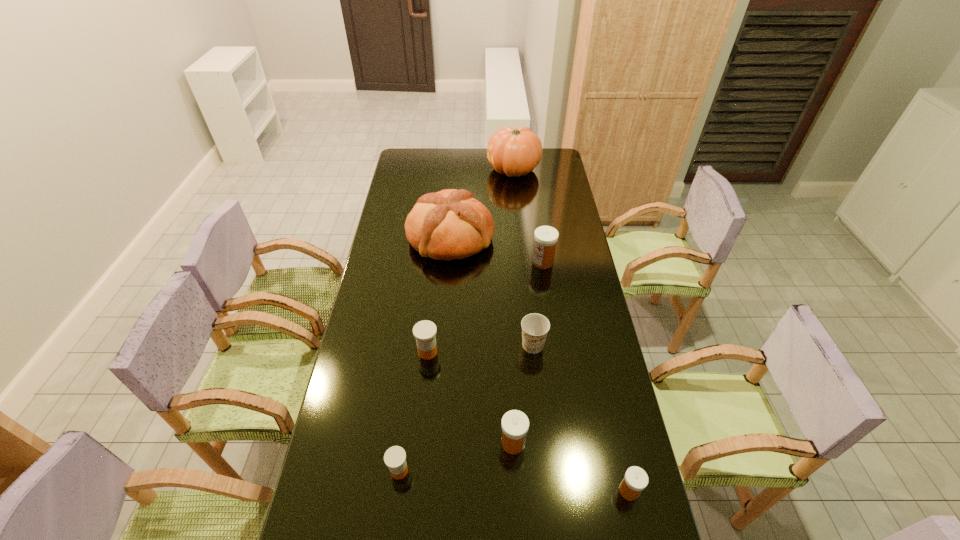
Find the location of a particular element. the smallest white medicine is located at coordinates (635, 480).

This screenshot has width=960, height=540. Identify the location of the nearest white medicine. (635, 480).

Locate an element on the screen. This screenshot has height=540, width=960. vacant space located on the carved face of the pumpkin is located at coordinates (431, 170).

Identify the location of vacant space positioned 0.400m on the carved face of the pumpkin. (410, 170).

Where is `vacant space located on the carved face of the pumpkin`? This screenshot has width=960, height=540. vacant space located on the carved face of the pumpkin is located at coordinates coord(468,170).

Where is `free spot located on the front of the bread`? The image size is (960, 540). free spot located on the front of the bread is located at coordinates (443, 338).

Locate an element on the screen. The height and width of the screenshot is (540, 960). vacant space located on the front of the farthest white medicine is located at coordinates (553, 333).

This screenshot has width=960, height=540. Find the location of `vacant space located 0.290m on the label of the bigger orange medicine`. vacant space located 0.290m on the label of the bigger orange medicine is located at coordinates (525, 352).

This screenshot has height=540, width=960. Find the location of `vacant region located on the right of the third medicine from right to left`. vacant region located on the right of the third medicine from right to left is located at coordinates (613, 443).

Find the location of `free space located 0.330m on the back of the Dixie cup`. free space located 0.330m on the back of the Dixie cup is located at coordinates (525, 268).